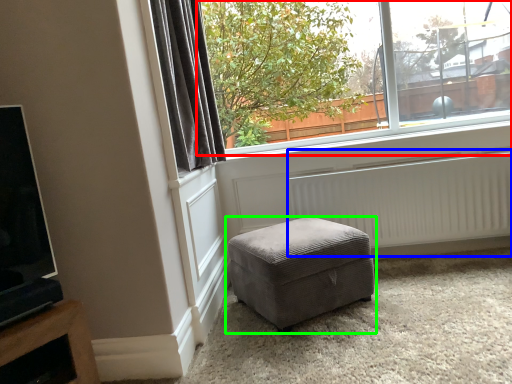
Question: Estimate the real-world distances between objects in this image. Which object is farther from window (highlighted by a red box), radiator (highlighted by a blue box) or studio couch (highlighted by a green box)?

Choices:
 (A) radiator
 (B) studio couch

Answer: (B)